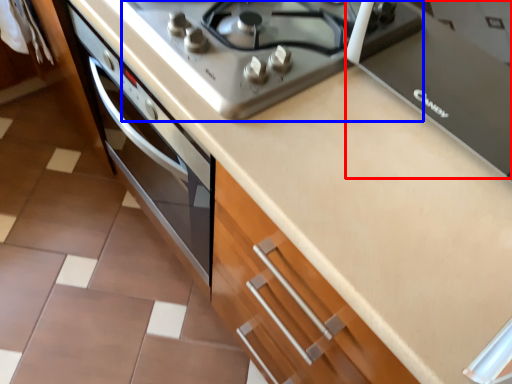
Question: Which object is closer to the camera taking this photo, appliance (highlighted by a red box) or gas stove (highlighted by a blue box)?

Choices:
 (A) appliance
 (B) gas stove

Answer: (A)